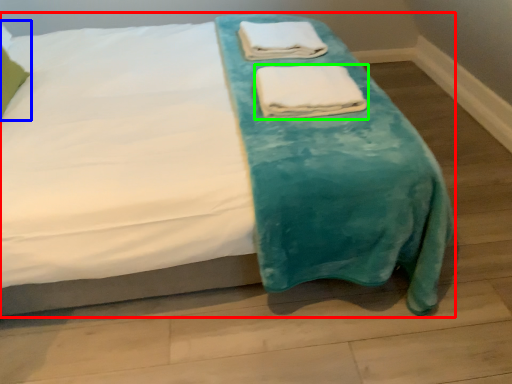
Question: Which object is the farthest from bed (highlighted by a red box)? Choose among these: pillow (highlighted by a blue box) or towel (highlighted by a green box).

Choices:
 (A) pillow
 (B) towel

Answer: (A)